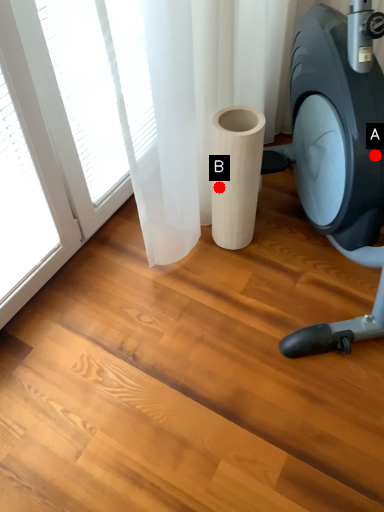
Question: Two points are circled on the image, labeled by A and B beside each circle. Which point is closer to the camera?

Choices:
 (A) A is closer
 (B) B is closer

Answer: (A)